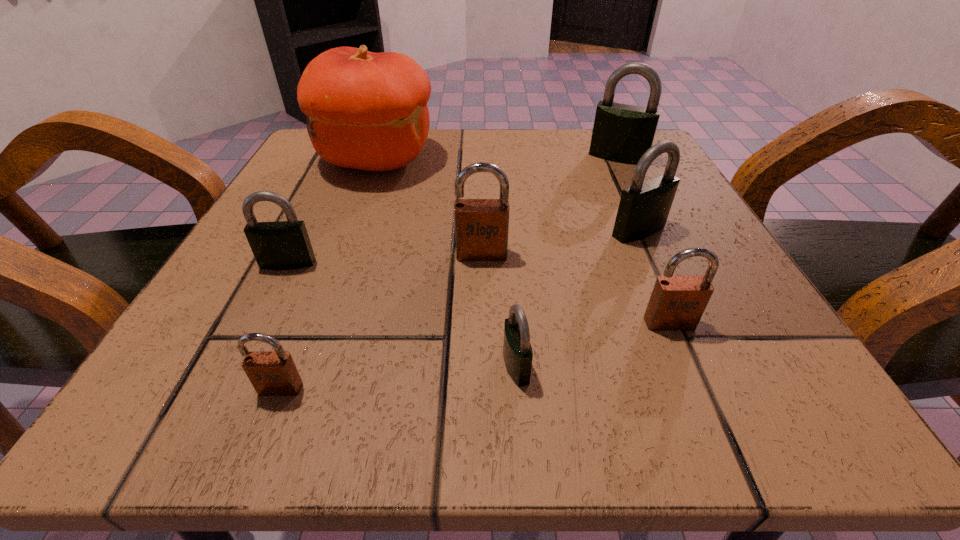
The image size is (960, 540). Find the location of `blank space at the left edge`. blank space at the left edge is located at coordinates (261, 276).

I want to click on free space at the right edge, so click(x=730, y=307).

Where is `vacant space at the far left corner`? This screenshot has width=960, height=540. vacant space at the far left corner is located at coordinates (327, 163).

Where is `vacant space at the near left corner of the desktop`? This screenshot has height=540, width=960. vacant space at the near left corner of the desktop is located at coordinates (264, 407).

Locate an element on the screen. free space at the far right corner of the desktop is located at coordinates (585, 151).

Find the location of `free space between the smallest black padlock and the sixth nearest object`. free space between the smallest black padlock and the sixth nearest object is located at coordinates (577, 298).

At what (x,y) coordinates should I click in order to perform the action: click on vacant point located between the nearest brown padlock and the third smallest black padlock. Please return your answer as a coordinate pair (x, y). Image resolution: width=960 pixels, height=540 pixels. Looking at the image, I should click on (460, 309).

Where is `free spot between the pumpkin and the second nearest black padlock`? Image resolution: width=960 pixels, height=540 pixels. free spot between the pumpkin and the second nearest black padlock is located at coordinates (332, 211).

This screenshot has width=960, height=540. In order to click on vacant point located between the biggest brown padlock and the pumpkin in this screenshot , I will do `click(429, 207)`.

You are a GUI agent. You are given a task and a screenshot of the screen. Output one action in this format:
    pyautogui.click(x=<x>, y=<y>)
    Task: Click on the vacant area that lies between the pumpkin and the fifth farthest padlock
    
    Given the screenshot: What is the action you would take?
    pyautogui.click(x=522, y=241)